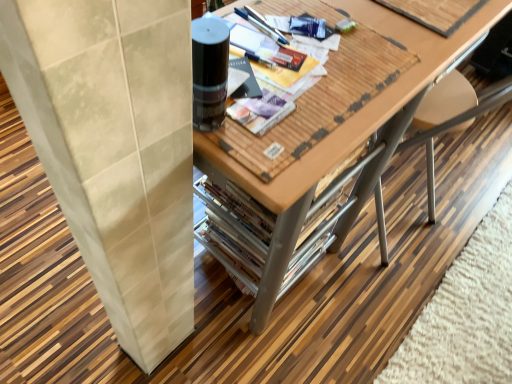
Question: Is wooden magazine at upper right, the 2th magazine from the bottom, completely or partially inside matte black magazine at center, the 2th magazine positioned from the right?

Choices:
 (A) yes
 (B) no

Answer: (B)

Question: Does matte black magazine at center, marked as the first magazine in a bottom-to-top arrangement, have a larger size compared to wooden magazine at upper right, positioned as the 2th magazine in front-to-back order?

Choices:
 (A) yes
 (B) no

Answer: (B)

Question: Is matte black magazine at center, which ranks as the 2th magazine in back-to-front order, touching wooden magazine at upper right, which appears as the 1th magazine when viewed from the back?

Choices:
 (A) no
 (B) yes

Answer: (A)

Question: Is matte black magazine at center, which ranks as the 2th magazine in back-to-front order, shorter than wooden magazine at upper right, the second magazine when ordered from left to right?

Choices:
 (A) no
 (B) yes

Answer: (B)

Question: Is matte black magazine at center, arranged as the second magazine when viewed from the top, turned away from wooden magazine at upper right, placed as the 1th magazine when sorted from top to bottom?

Choices:
 (A) no
 (B) yes

Answer: (A)

Question: Could you tell me if matte black magazine at center, which ranks as the 2th magazine in back-to-front order, is turned towards wooden magazine at upper right, which appears as the 1th magazine when viewed from the back?

Choices:
 (A) no
 (B) yes

Answer: (A)

Question: Does wooden table at center turn towards wooden magazine at upper right, which is counted as the first magazine, starting from the right?

Choices:
 (A) yes
 (B) no

Answer: (B)

Question: Does wooden table at center have a lesser height compared to wooden magazine at upper right, the second magazine when ordered from left to right?

Choices:
 (A) no
 (B) yes

Answer: (A)

Question: Considering the relative sizes of wooden table at center and wooden magazine at upper right, the second magazine when ordered from left to right, in the image provided, is wooden table at center taller than wooden magazine at upper right, the second magazine when ordered from left to right,?

Choices:
 (A) no
 (B) yes

Answer: (B)

Question: Is wooden table at center positioned before wooden magazine at upper right, the second magazine when ordered from left to right?

Choices:
 (A) no
 (B) yes

Answer: (B)

Question: Is wooden table at center positioned with its back to wooden magazine at upper right, the second magazine when ordered from left to right?

Choices:
 (A) no
 (B) yes

Answer: (A)

Question: Can you confirm if wooden table at center is positioned to the left of wooden magazine at upper right, the 2th magazine from the bottom?

Choices:
 (A) yes
 (B) no

Answer: (A)

Question: Considering the relative positions of matte black magazine at center, which ranks as the 1th magazine in left-to-right order, and wooden table at center in the image provided, is matte black magazine at center, which ranks as the 1th magazine in left-to-right order, to the right of wooden table at center from the viewer's perspective?

Choices:
 (A) no
 (B) yes

Answer: (A)